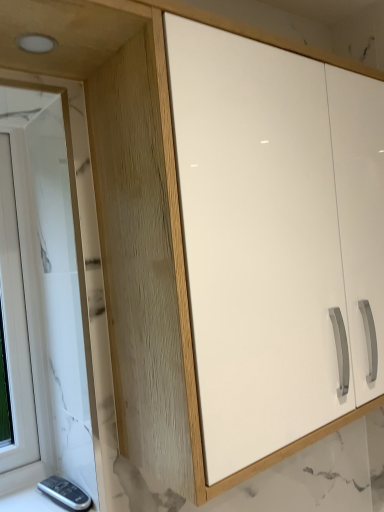
What is the approximate width of white glossy cabinet at center?

white glossy cabinet at center is 10.81 inches in width.

Identify the location of white glossy cabinet at center. This screenshot has width=384, height=512. (257, 242).

In order to face white glossy cabinet at center, should I rotate leftwards or rightwards?

To align with it, rotate right about 13.383°.

Describe the element at coordinates (257, 242) in the screenshot. I see `white glossy cabinet at center` at that location.

What is the approximate height of white glossy cabinet at center?

77.62 centimeters.

Where is `white marble window at left`? This screenshot has width=384, height=512. white marble window at left is located at coordinates (44, 298).

Measure the distance between point (29,116) and camera.

A distance of 36.42 inches exists between point (29,116) and camera.

What do you see at coordinates (44, 298) in the screenshot?
I see `white marble window at left` at bounding box center [44, 298].

The image size is (384, 512). I want to click on white glossy cabinet at center, so click(x=257, y=242).

Can you confirm if white glossy cabinet at center is positioned to the right of white marble window at left?

Correct, you'll find white glossy cabinet at center to the right of white marble window at left.

Between white glossy cabinet at center and white marble window at left, which one is positioned in front?

white glossy cabinet at center is closer to the camera.

Considering the points (195, 312) and (56, 444), which point is behind, point (195, 312) or point (56, 444)?

The point (56, 444) is behind.

From the image's perspective, between white glossy cabinet at center and white marble window at left, who is located below?

white marble window at left appears lower in the image.

From a real-world perspective, is white glossy cabinet at center above or below white marble window at left?

In terms of real-world spatial position, white glossy cabinet at center is above white marble window at left.

Considering the relative sizes of white glossy cabinet at center and white marble window at left in the image provided, is white glossy cabinet at center thinner than white marble window at left?

No, white glossy cabinet at center is not thinner than white marble window at left.

Can you confirm if white glossy cabinet at center is taller than white marble window at left?

No, white glossy cabinet at center is not taller than white marble window at left.

Does white glossy cabinet at center have a larger size compared to white marble window at left?

Yes, white glossy cabinet at center is bigger than white marble window at left.

Is white marble window at left inside white glossy cabinet at center?

No, white marble window at left is not surrounded by white glossy cabinet at center.

Is white glossy cabinet at center far away from white marble window at left?

That's not correct — white glossy cabinet at center is a little close to white marble window at left.

Could you tell me if white glossy cabinet at center is turned towards white marble window at left?

No.

How far apart are white glossy cabinet at center and white marble window at left?

A distance of 14.49 inches exists between white glossy cabinet at center and white marble window at left.

The image size is (384, 512). I want to click on screen door in front of the white marble window at left, so click(x=257, y=242).

Would you say white marble window at left is to the left or to the right of white glossy cabinet at center in the picture?

From the image, it's evident that white marble window at left is to the left of white glossy cabinet at center.

Is the position of white marble window at left less distant than that of white glossy cabinet at center?

No, white marble window at left is further to the viewer.

Is point (19, 224) in front of point (345, 316)?

That is False.

From the image's perspective, between white marble window at left and white glossy cabinet at center, which one is located above?

white glossy cabinet at center appears higher in the image.

From a real-world perspective, between white marble window at left and white glossy cabinet at center, who is vertically higher?

In real-world perspective, white glossy cabinet at center is above.

Considering the sizes of objects white marble window at left and white glossy cabinet at center in the image provided, who is thinner, white marble window at left or white glossy cabinet at center?

white marble window at left is thinner.

Consider the image. Can you confirm if white marble window at left is shorter than white glossy cabinet at center?

In fact, white marble window at left may be taller than white glossy cabinet at center.

Based on their sizes in the image, would you say white marble window at left is bigger or smaller than white glossy cabinet at center?

white marble window at left is smaller than white glossy cabinet at center.

Would you say white marble window at left contains white glossy cabinet at center?

No.

Are white marble window at left and white glossy cabinet at center making contact?

No, white marble window at left is not in contact with white glossy cabinet at center.

Is white marble window at left facing away from white glossy cabinet at center?

No.

Find the location of a particular element. The image size is (384, 512). screen door that appears above the white marble window at left (from the image's perspective) is located at coordinates (257, 242).

Where is `window on the left of white glossy cabinet at center`? The width and height of the screenshot is (384, 512). window on the left of white glossy cabinet at center is located at coordinates (44, 298).

Identify the location of screen door lying on the right of white marble window at left. This screenshot has width=384, height=512. (257, 242).